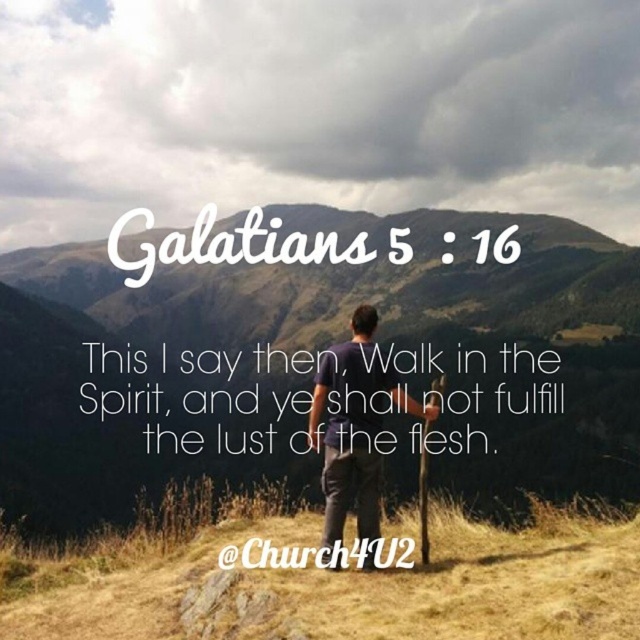
Which is behind, point (454, 240) or point (323, 388)?

Positioned behind is point (454, 240).

Between brown grassy hill at center and dark blue t-shirt at center, which one appears on the right side from the viewer's perspective?

dark blue t-shirt at center is more to the right.

Between point (3, 259) and point (372, 499), which one is positioned behind?

Positioned behind is point (3, 259).

Where is `brown grassy hill at center`? The height and width of the screenshot is (640, 640). brown grassy hill at center is located at coordinates (316, 358).